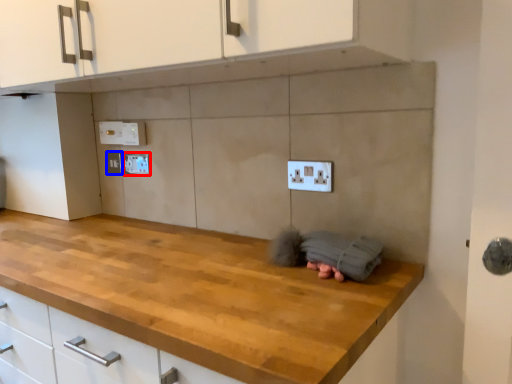
Question: Which of the following is the farthest to the observer, electric outlet (highlighted by a red box) or electric outlet (highlighted by a blue box)?

Choices:
 (A) electric outlet
 (B) electric outlet

Answer: (B)